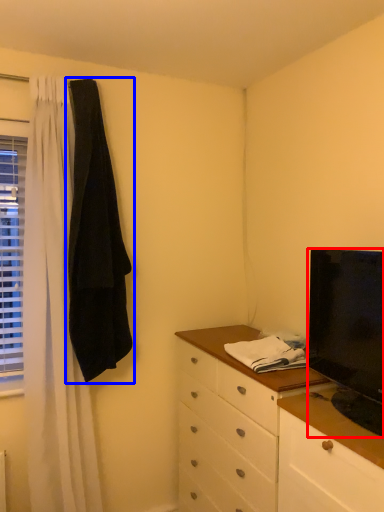
Question: Which object appears closest to the camera in this image, television (highlighted by a red box) or robe (highlighted by a blue box)?

Choices:
 (A) television
 (B) robe

Answer: (A)